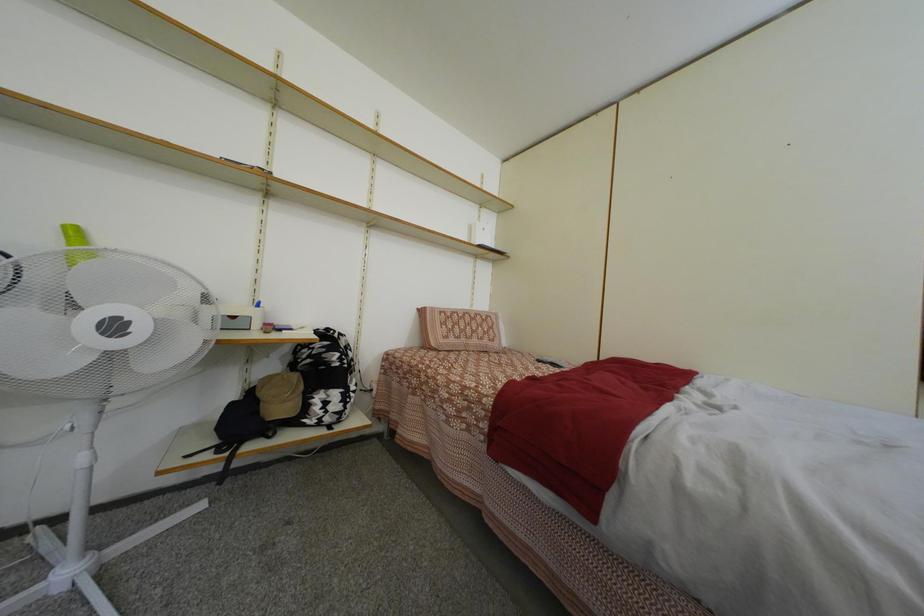
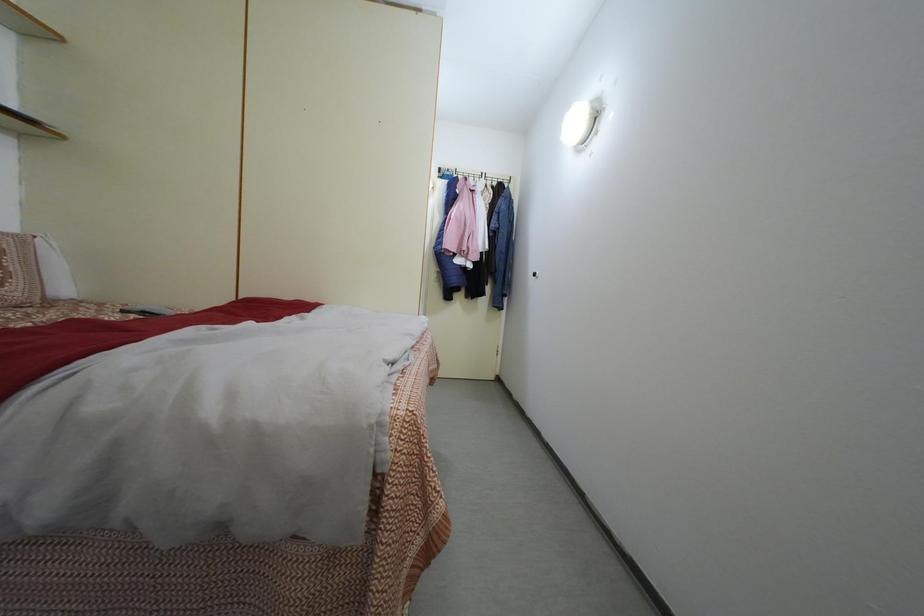
Question: The first image is from the beginning of the video and the second image is from the end. How did the camera likely rotate when shooting the video?

Choices:
 (A) Left
 (B) Right
 (C) Up
 (D) Down

Answer: (B)